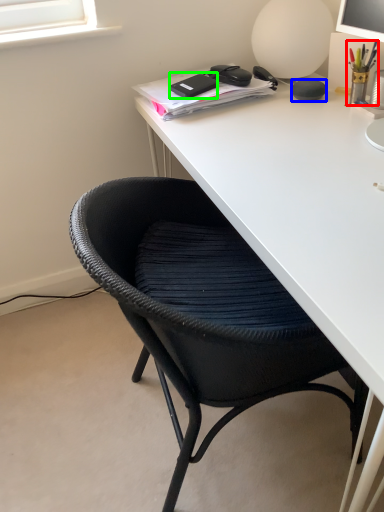
Question: Which object is the closest to the stationery (highlighted by a red box)? Choose among these: stationery (highlighted by a blue box) or stationery (highlighted by a green box).

Choices:
 (A) stationery
 (B) stationery

Answer: (A)